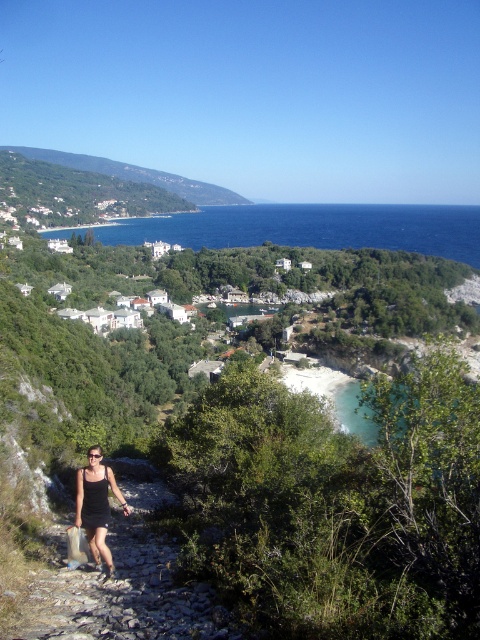
Question: Which point appears closest to the camera in this image?

Choices:
 (A) (454, 236)
 (B) (147, 598)

Answer: (B)

Question: Which point is closer to the camera?

Choices:
 (A) black fabric dress at lower left
 (B) black gravel path at lower left

Answer: (B)

Question: Which point is farther to the camera?

Choices:
 (A) black fabric dress at lower left
 (B) black gravel path at lower left

Answer: (A)

Question: Does black gravel path at lower left have a lesser width compared to black fabric dress at lower left?

Choices:
 (A) no
 (B) yes

Answer: (A)

Question: Can you confirm if blue water at center is positioned to the left of black fabric dress at lower left?

Choices:
 (A) no
 (B) yes

Answer: (A)

Question: Can you confirm if blue water at center is bigger than black fabric dress at lower left?

Choices:
 (A) no
 (B) yes

Answer: (B)